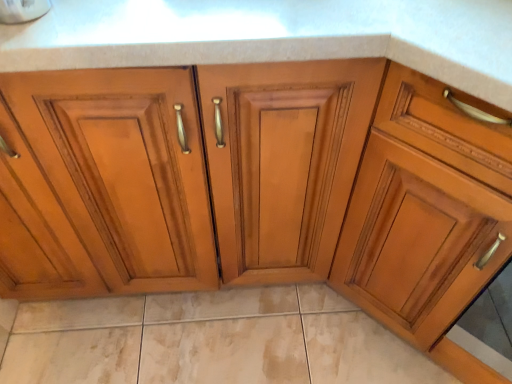
Question: From the image's perspective, is beige marble tile at lower center above or below matte wood cabinet at right?

Choices:
 (A) below
 (B) above

Answer: (A)

Question: Looking at their shapes, would you say beige marble tile at lower center is wider or thinner than matte wood cabinet at right?

Choices:
 (A) wide
 (B) thin

Answer: (B)

Question: In the image, is beige marble tile at lower center on the left side or the right side of matte wood cabinet at right?

Choices:
 (A) left
 (B) right

Answer: (A)

Question: Visually, is matte wood cabinet at right positioned to the left or to the right of beige marble tile at lower center?

Choices:
 (A) right
 (B) left

Answer: (A)

Question: Which is correct: matte wood cabinet at right is inside beige marble tile at lower center, or outside of it?

Choices:
 (A) outside
 (B) inside

Answer: (A)

Question: Relative to beige marble tile at lower center, is matte wood cabinet at right in front or behind?

Choices:
 (A) front
 (B) behind

Answer: (A)

Question: From the image's perspective, is matte wood cabinet at right positioned above or below beige marble tile at lower center?

Choices:
 (A) below
 (B) above

Answer: (B)